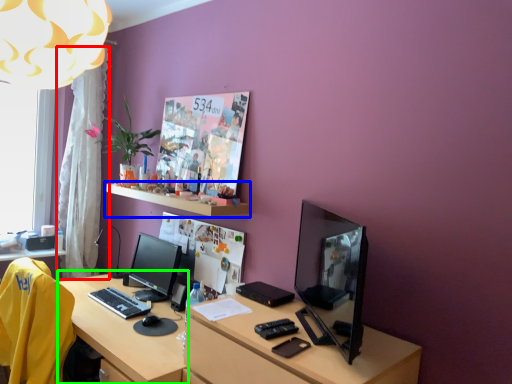
Question: Considering the real-world distances, which object is farthest from curtain (highlighted by a red box)? shelf (highlighted by a blue box) or vanity (highlighted by a green box)?

Choices:
 (A) shelf
 (B) vanity

Answer: (B)